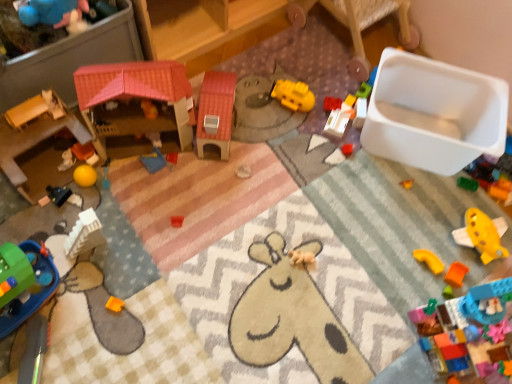
The width and height of the screenshot is (512, 384). In order to click on vacant space that is in between black plastic toy at lower left, arranged as the 3th toy when viewed from the left, and blue plastic tray at center, acting as the 6th toy starting from the left in this screenshot , I will do click(x=111, y=183).